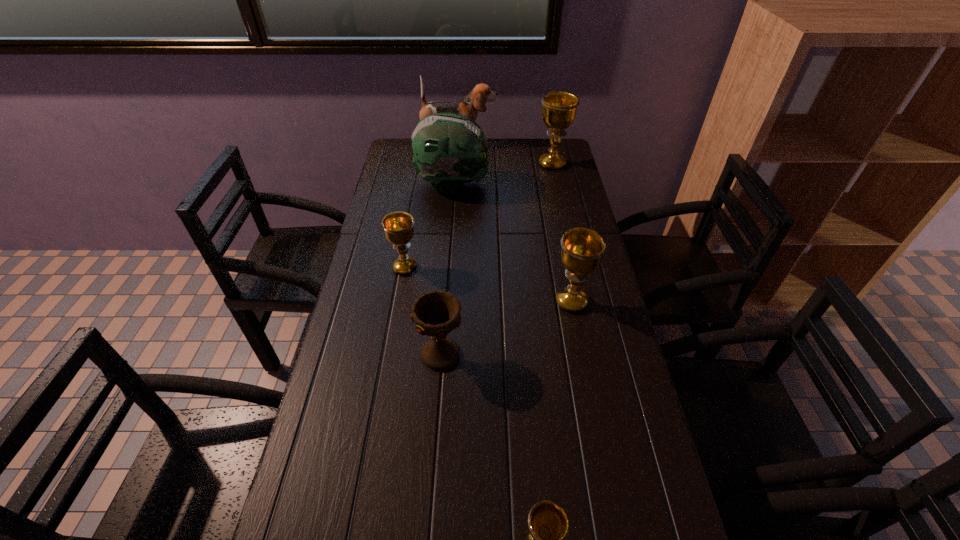
Where is `puppy`? The height and width of the screenshot is (540, 960). puppy is located at coordinates (469, 106).

At what (x,y) coordinates should I click in order to perform the action: click on brown puppy. Please return your answer as a coordinate pair (x, y). This screenshot has width=960, height=540. Looking at the image, I should click on (469, 106).

I want to click on the tallest chalice, so click(559, 108).

Where is `the biggest gold chalice`? The width and height of the screenshot is (960, 540). the biggest gold chalice is located at coordinates (559, 108).

This screenshot has height=540, width=960. I want to click on football helmet, so click(450, 149).

You are a GUI agent. You are given a task and a screenshot of the screen. Output one action in this format:
    pyautogui.click(x=<x>, y=<y>)
    Task: Click on the second tallest chalice
    The height and width of the screenshot is (540, 960).
    Given the screenshot: What is the action you would take?
    pyautogui.click(x=582, y=249)

The width and height of the screenshot is (960, 540). What are the coordinates of `the third farthest chalice` in the screenshot? It's located at (582, 249).

Locate an element on the screen. the second nearest object is located at coordinates (437, 313).

Where is `red chalice`? red chalice is located at coordinates (437, 313).

This screenshot has height=540, width=960. I want to click on the leftmost chalice, so click(x=398, y=227).